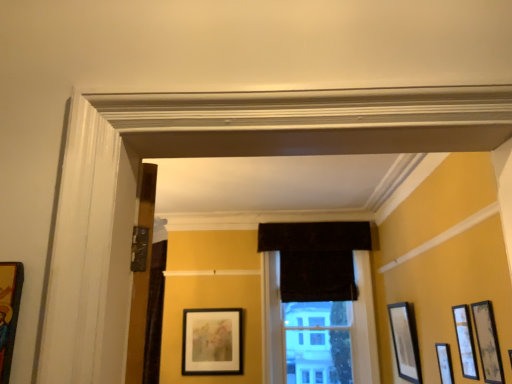
Question: Considering the positions of matte black picture frame at right, the 6th picture frame from the left, and matte black picture frame at right, the fourth picture frame viewed from the front, in the image, is matte black picture frame at right, the 6th picture frame from the left, bigger or smaller than matte black picture frame at right, the fourth picture frame viewed from the front,?

Choices:
 (A) small
 (B) big

Answer: (B)

Question: Is point coord(410,324) closer or farther from the camera than point coord(444,377)?

Choices:
 (A) closer
 (B) farther

Answer: (B)

Question: Which object is positioned farthest from the black velvet curtain at center?

Choices:
 (A) velvet dark brown curtain at center
 (B) wooden picture frame at left, the 6th picture frame viewed from the right
 (C) matte black picture frame at right, acting as the 5th picture frame starting from the front
 (D) matte black picture frame at right, positioned as the fifth picture frame in left-to-right order
 (E) matte black picture frame at center, which ranks as the second picture frame in left-to-right order

Answer: (B)

Question: Based on their relative distances, which object is nearer to the black velvet curtain at center?

Choices:
 (A) matte black picture frame at right, the fourth picture frame viewed from the front
 (B) matte black picture frame at right, acting as the 5th picture frame starting from the front
 (C) matte black picture frame at center, the sixth picture frame viewed from the front
 (D) velvet dark brown curtain at center
 (E) wooden picture frame at left, placed as the 6th picture frame when sorted from back to front

Answer: (D)